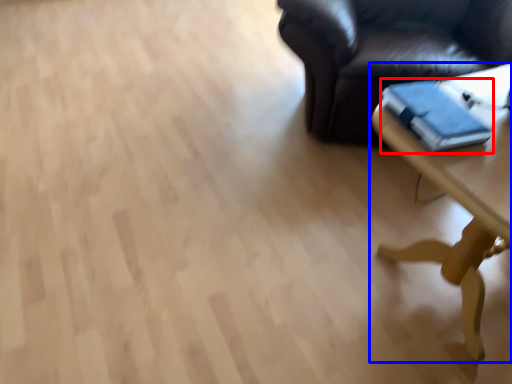
Question: Which object appears farthest to the camera in this image, book (highlighted by a red box) or table (highlighted by a blue box)?

Choices:
 (A) book
 (B) table

Answer: (A)